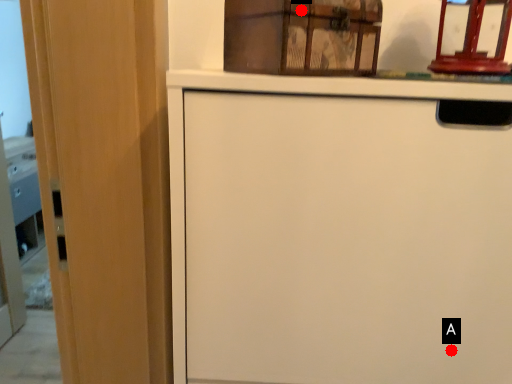
Question: Two points are circled on the image, labeled by A and B beside each circle. Which of the following is the closest to the observer?

Choices:
 (A) A is closer
 (B) B is closer

Answer: (B)